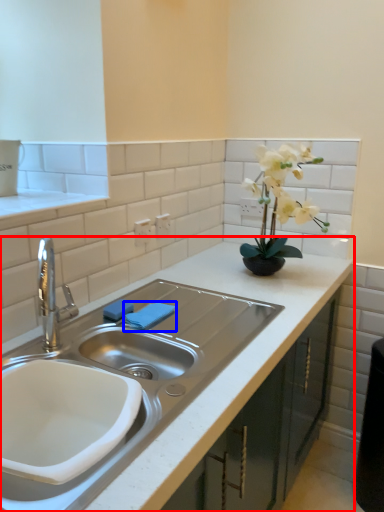
Question: Which object is further to the camera taking this photo, countertop (highlighted by a red box) or towel bar (highlighted by a blue box)?

Choices:
 (A) countertop
 (B) towel bar

Answer: (B)